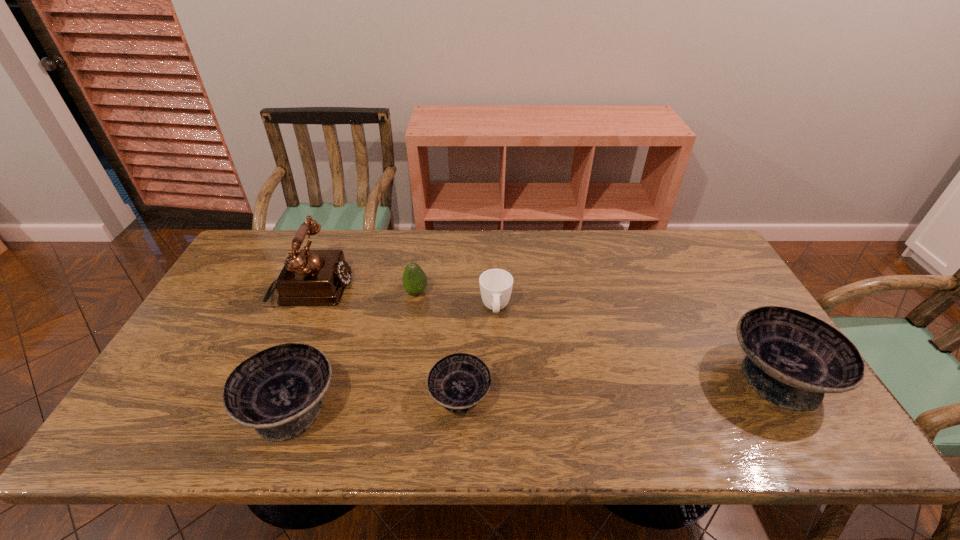
Find the location of a particular element. Image resolution: width=960 pixels, height=540 pixels. vacant space located on the left of the avocado is located at coordinates (361, 293).

Locate an element on the screen. This screenshot has width=960, height=540. vacant space located on the dial of the tallest object is located at coordinates (393, 290).

In order to click on free space located 0.140m with the handle on the side of the cup in this screenshot , I will do `click(498, 366)`.

Identify the location of object positioned at the far edge. pos(309,277).

Where is `object that is at the left edge`? object that is at the left edge is located at coordinates (309, 277).

Identify the location of object present at the right edge. (793, 359).

Identify the location of object situated at the far left corner. (309, 277).

Find the location of a particular element. This screenshot has height=540, width=960. object that is positioned at the near right corner is located at coordinates (793, 359).

At what (x,y) coordinates should I click in order to perform the action: click on free spot at the far edge of the desktop. Please return your answer as a coordinate pair (x, y). The height and width of the screenshot is (540, 960). Looking at the image, I should click on (511, 230).

This screenshot has height=540, width=960. I want to click on free space at the near edge of the desktop, so click(521, 413).